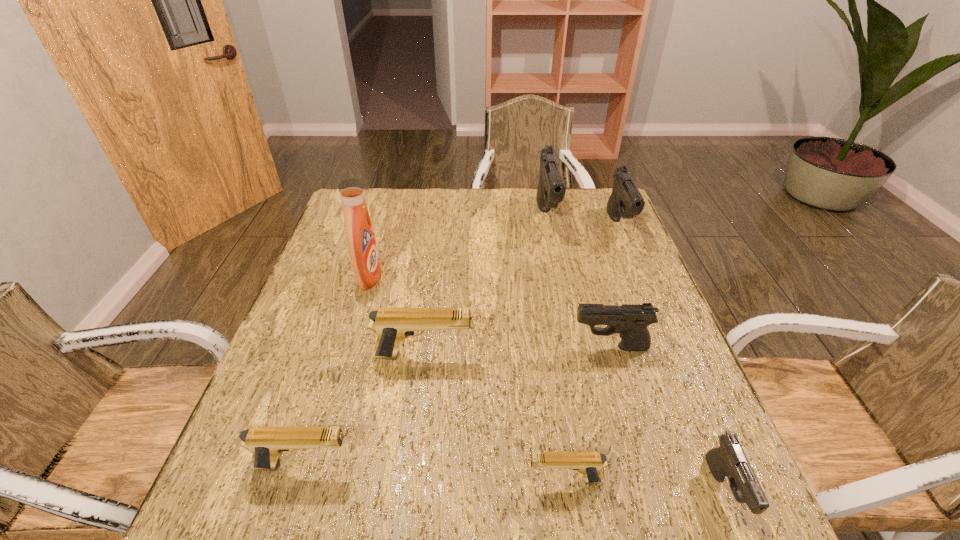
You are a GUI agent. You are given a task and a screenshot of the screen. Output one action in this format:
    pyautogui.click(x=<x>, y=<y>)
    Task: Click on the rightmost tan pistol
    The height and width of the screenshot is (540, 960).
    Given the screenshot: What is the action you would take?
    pyautogui.click(x=590, y=464)

Where is `the nearest tan pistol`? the nearest tan pistol is located at coordinates (590, 464).

You are a GUI agent. You are given a task and a screenshot of the screen. Output one action in this format:
    pyautogui.click(x=<x>, y=<y>)
    Task: Click on the free space located on the front-facing side of the tallest object
    
    Given the screenshot: What is the action you would take?
    pyautogui.click(x=483, y=277)

Where is `free space located 0.170m at the barrel of the seventh shortest object`? free space located 0.170m at the barrel of the seventh shortest object is located at coordinates (560, 279).

Find the location of a particular element. free space located 0.190m at the barrel of the second tallest pistol is located at coordinates (646, 291).

Find the location of a particular element. This screenshot has width=960, height=540. free point located 0.350m at the barrel of the biggest tan pistol is located at coordinates (626, 355).

This screenshot has height=540, width=960. Identify the location of free location located at the barrel of the second nearest black pistol. [x=407, y=347].

Where is `vacant region located 0.070m at the barrel of the second nearest black pistol`? This screenshot has height=540, width=960. vacant region located 0.070m at the barrel of the second nearest black pistol is located at coordinates (541, 347).

Identify the location of blank space located at the barrel of the second nearest black pistol. The image size is (960, 540). (450, 347).

Find the location of a particular element. Image resolution: width=960 pixels, height=540 pixels. free space located at the barrel of the second nearest tan pistol is located at coordinates (532, 465).